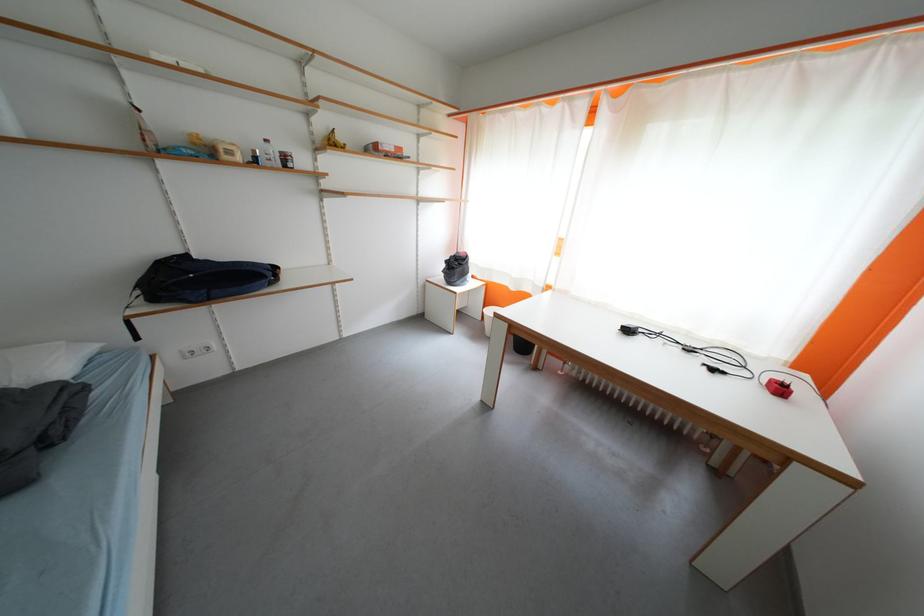
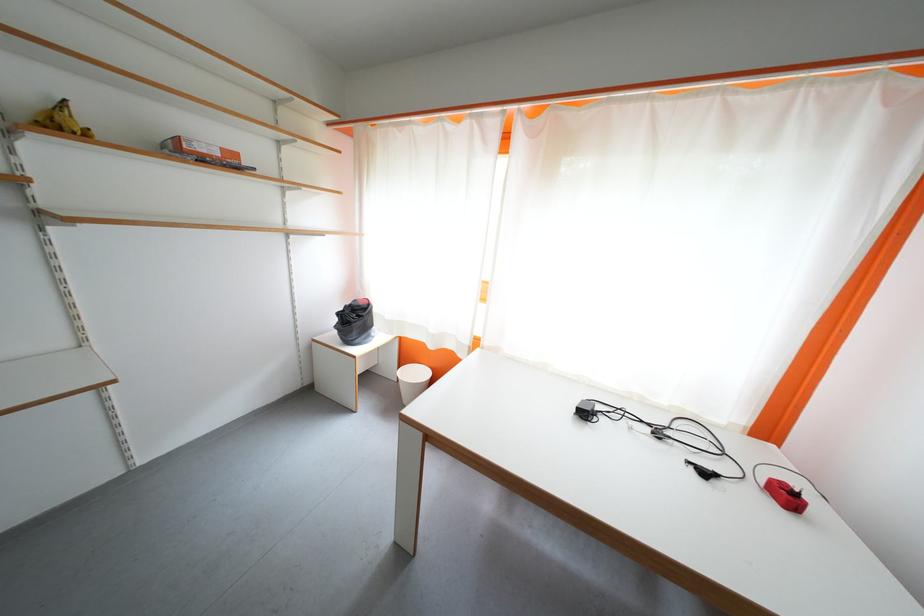
The point at (492, 310) is marked in the first image. Where is the corresponding point in the second image?

(407, 370)